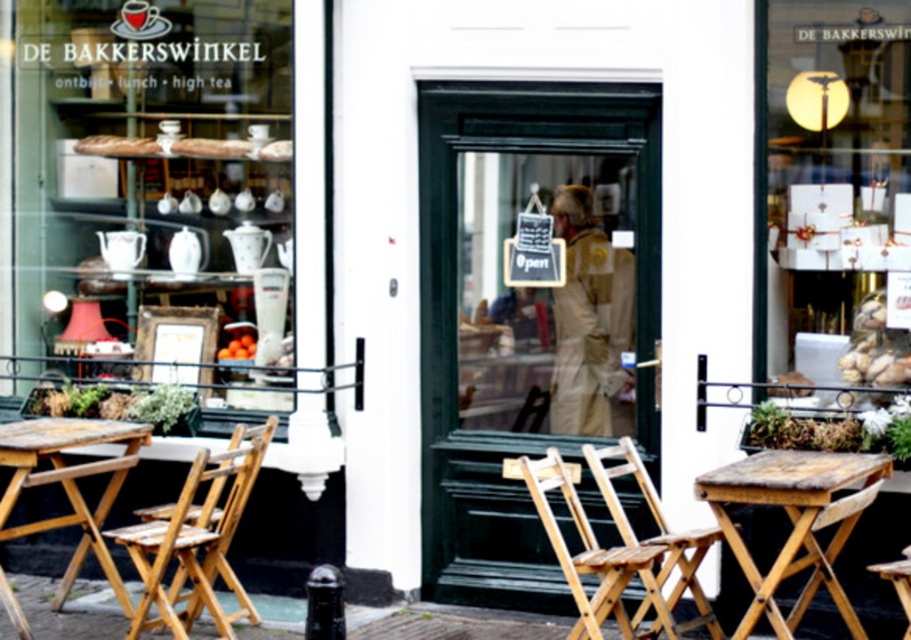
You are a customer entering the bakery and want to find the entrance. Which object is located below the other between the green wooden door at center and the white paper gift boxes at upper center?

The green wooden door at center is positioned below the white paper gift boxes at upper center, so the door is the entrance located beneath the gift boxes.